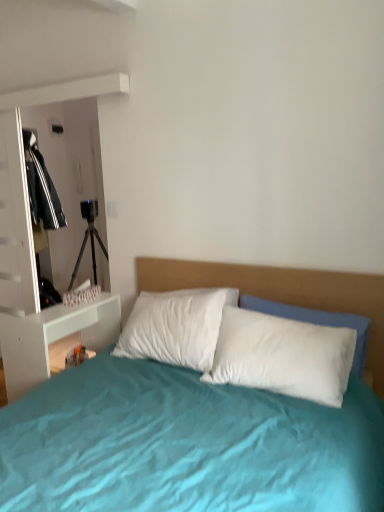
Question: Based on their positions, is white glossy nightstand at left located to the left or right of white soft pillow at center?

Choices:
 (A) right
 (B) left

Answer: (B)

Question: From a real-world perspective, is white glossy nightstand at left physically located above or below white soft pillow at center?

Choices:
 (A) above
 (B) below

Answer: (B)

Question: Does point (13, 381) appear closer or farther from the camera than point (304, 394)?

Choices:
 (A) closer
 (B) farther

Answer: (B)

Question: Considering the positions of point (329, 352) and point (16, 386), is point (329, 352) closer or farther from the camera than point (16, 386)?

Choices:
 (A) farther
 (B) closer

Answer: (B)

Question: Looking at the image, does white soft pillow at center seem bigger or smaller compared to white glossy nightstand at left?

Choices:
 (A) small
 (B) big

Answer: (A)

Question: From a real-world perspective, is white soft pillow at center physically located above or below white glossy nightstand at left?

Choices:
 (A) below
 (B) above

Answer: (B)

Question: Is white soft pillow at center taller or shorter than white glossy nightstand at left?

Choices:
 (A) short
 (B) tall

Answer: (A)